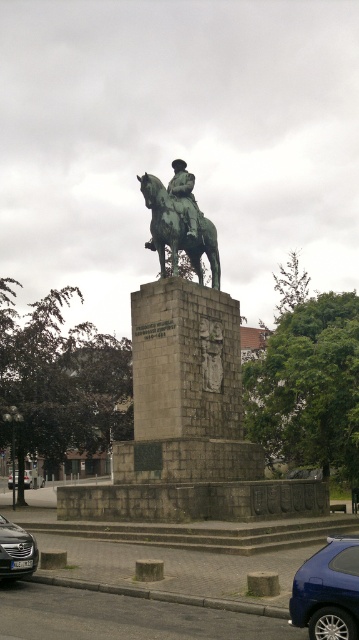
Question: Which point is closer to the camera?

Choices:
 (A) (140, 365)
 (B) (202, 349)
 (C) (313, 611)
 (D) (188, 212)

Answer: (C)

Question: Does green polished metal horse at center come behind bronze statue at center?

Choices:
 (A) no
 (B) yes

Answer: (A)

Question: Estimate the real-world distances between objects in this image. Which object is closer to the metallic silver car at lower left?

Choices:
 (A) bronze statue at center
 (B) green polished metal horse at center

Answer: (B)

Question: Can you confirm if blue metallic car at lower right is positioned to the right of black glossy car at lower left?

Choices:
 (A) yes
 (B) no

Answer: (A)

Question: Is the position of blue metallic car at lower right more distant than that of bronze statue at center?

Choices:
 (A) yes
 (B) no

Answer: (B)

Question: Which point is farther to the camera?

Choices:
 (A) metallic silver car at lower left
 (B) green polished stone statue at center
 (C) black glossy car at lower left

Answer: (A)